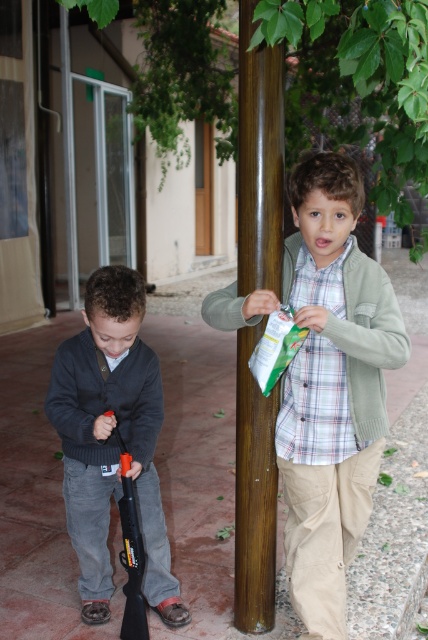
You are a photographer taking a picture of the two boys. You notice two points in the image at coordinates point (130, 396) and point (121, 515). Which point is closer to you?

Point (130, 396) is further to the viewer than point (121, 515), so the point closer to you is point (121, 515).